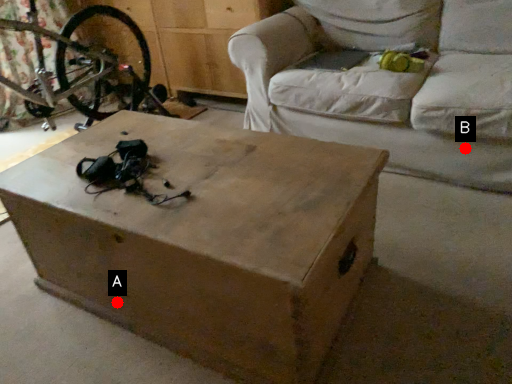
Question: Two points are circled on the image, labeled by A and B beside each circle. Which point appears farthest from the camera in this image?

Choices:
 (A) A is further
 (B) B is further

Answer: (B)